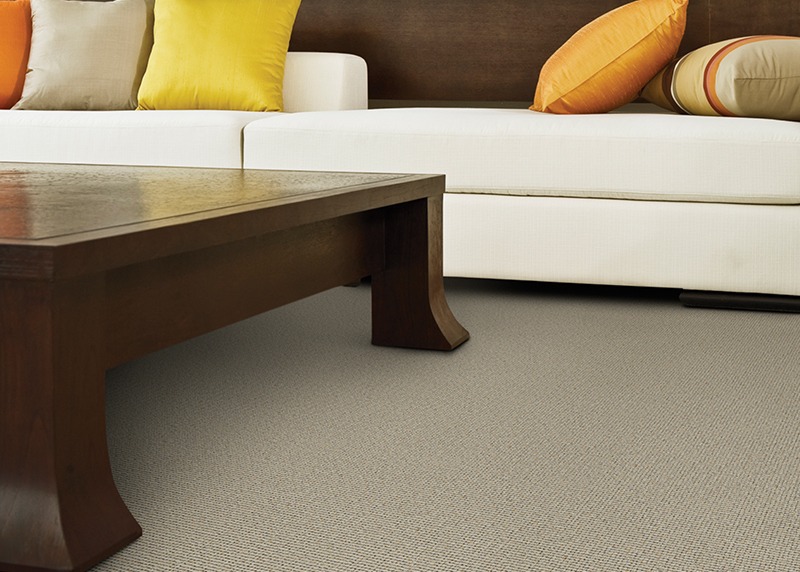
This screenshot has width=800, height=572. I want to click on couch, so click(x=517, y=165).